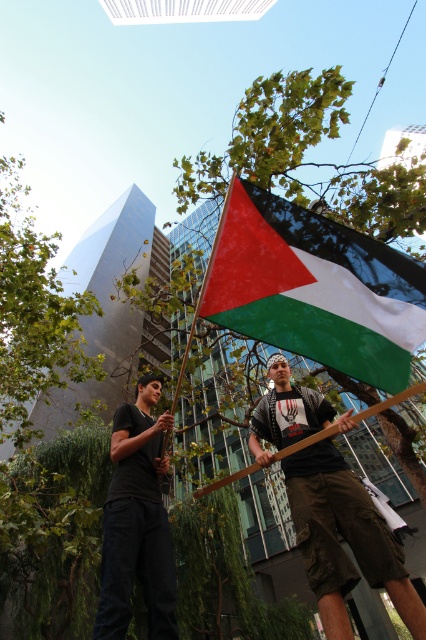
Question: Which object is positioned farthest from the black matte shirt at center?

Choices:
 (A) matte black t-shirt at center
 (B) polyester flag at center

Answer: (B)

Question: Is matte black t-shirt at center positioned in front of black matte shirt at center?

Choices:
 (A) yes
 (B) no

Answer: (B)

Question: Which point is farther to the camera?

Choices:
 (A) (121, 524)
 (B) (342, 609)

Answer: (A)

Question: From the image, what is the correct spatial relationship of polyester flag at center in relation to matte black t-shirt at center?

Choices:
 (A) above
 (B) below

Answer: (A)

Question: Does polyester flag at center have a smaller size compared to matte black t-shirt at center?

Choices:
 (A) yes
 (B) no

Answer: (A)

Question: Which is farther from the matte black t-shirt at center?

Choices:
 (A) polyester flag at center
 (B) black matte shirt at center

Answer: (A)